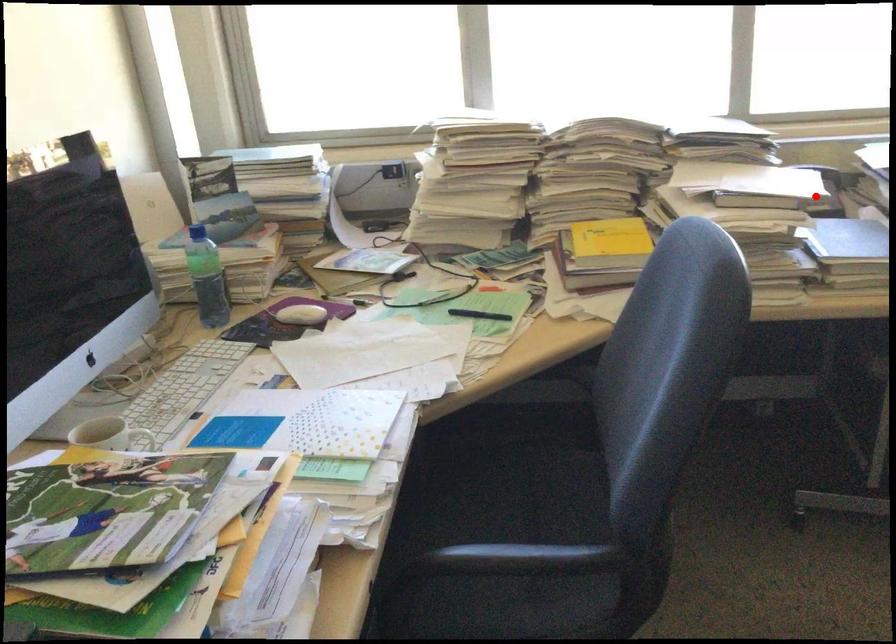
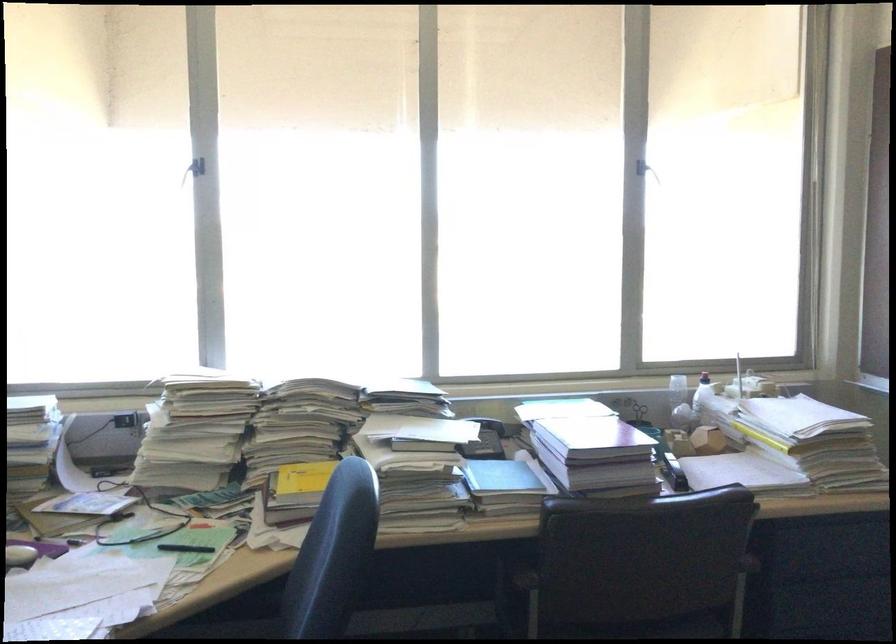
Question: I am providing you with two images of the same scene from different viewpoints. Given a red point in image1, look at the same physical point in image2. Is it:

Choices:
 (A) Closer to the viewpoint
 (B) Farther from the viewpoint

Answer: (B)